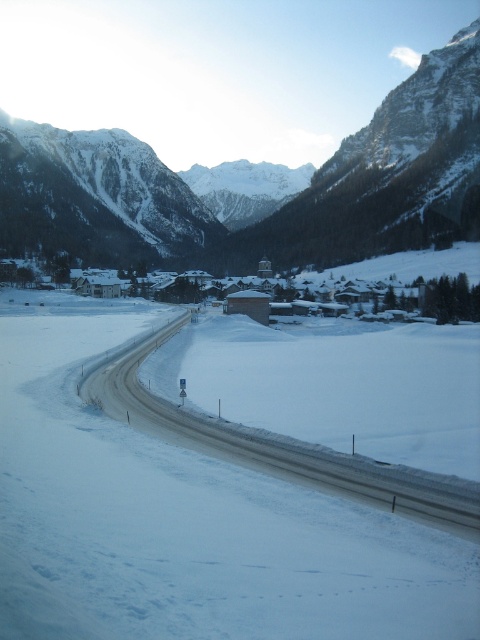
Question: Is snowy granite mountain range at upper center to the left of white asphalt highway at center from the viewer's perspective?

Choices:
 (A) yes
 (B) no

Answer: (A)

Question: Does snowy granite mountain range at upper center have a lesser width compared to white asphalt highway at center?

Choices:
 (A) no
 (B) yes

Answer: (A)

Question: Which of the following is the farthest from the observer?

Choices:
 (A) (139, 348)
 (B) (395, 122)

Answer: (B)

Question: Which point is closer to the camera?

Choices:
 (A) (308, 243)
 (B) (219, 420)

Answer: (B)

Question: Which object appears closest to the camera in this image?

Choices:
 (A) white asphalt highway at center
 (B) snowy granite mountain range at upper center

Answer: (A)

Question: Is the position of snowy granite mountain range at upper center more distant than that of white asphalt highway at center?

Choices:
 (A) no
 (B) yes

Answer: (B)